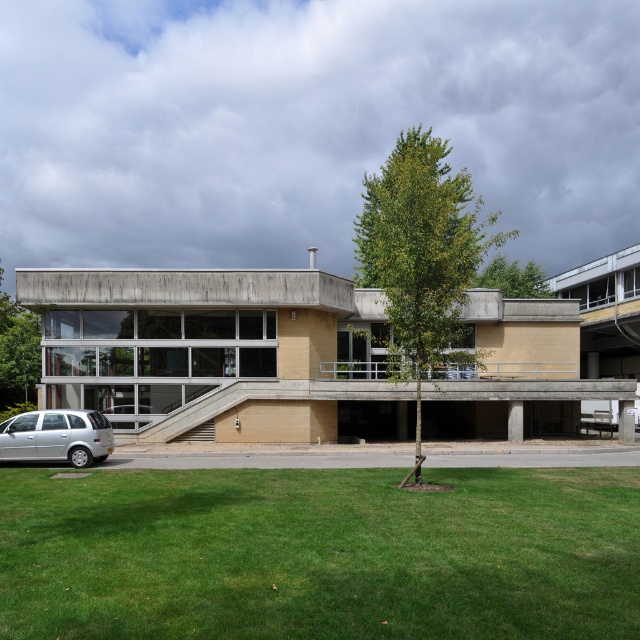
Question: Is green leafy tree at left bigger than green leafy tree at upper right?

Choices:
 (A) no
 (B) yes

Answer: (A)

Question: Can you confirm if silver metallic hatchback at lower left is wider than green leafy tree at upper right?

Choices:
 (A) yes
 (B) no

Answer: (B)

Question: Which point appears farthest from the camera in this image?

Choices:
 (A) (19, 394)
 (B) (413, 324)

Answer: (A)

Question: Can you confirm if green leafy tree at center is positioned to the right of silver metallic hatchback at lower left?

Choices:
 (A) no
 (B) yes

Answer: (B)

Question: Which point appears farthest from the camera in this image?

Choices:
 (A) (403, 252)
 (B) (56, 448)

Answer: (B)

Question: Which point is closer to the camera?

Choices:
 (A) silver metallic hatchback at lower left
 (B) green grass at lower center
 (C) green leafy tree at upper right
 (D) green leafy tree at center

Answer: (B)